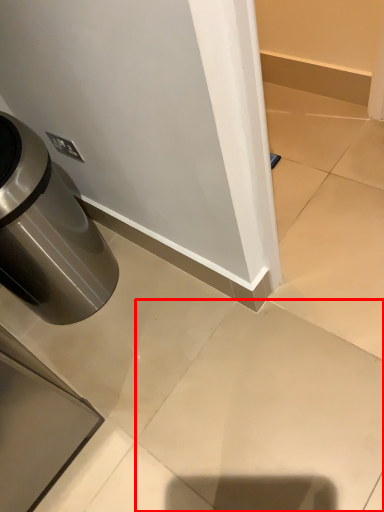
Question: From the image's perspective, what is the correct spatial positioning of concrete (annotated by the red box) in reference to waste container?

Choices:
 (A) below
 (B) above

Answer: (A)